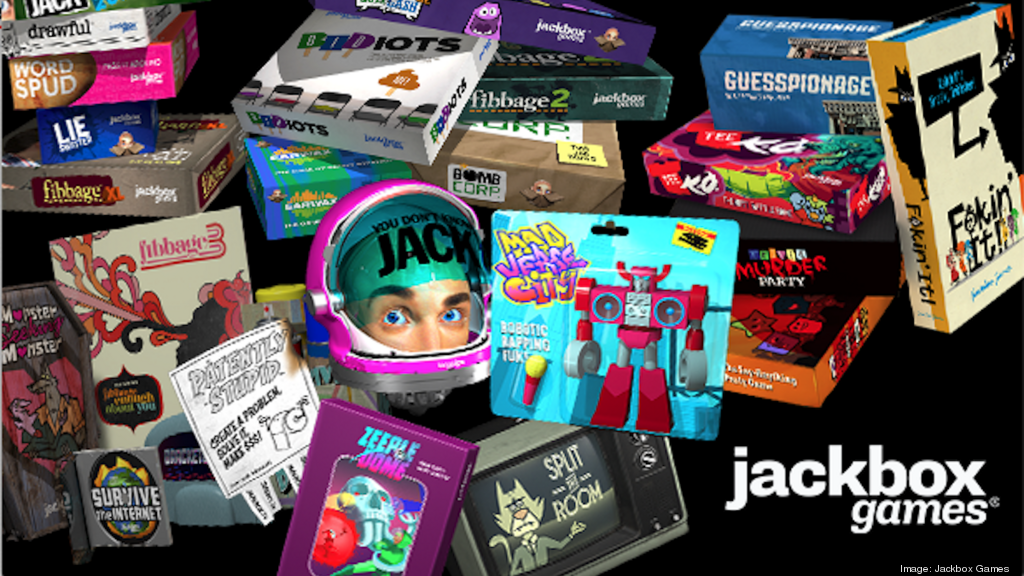
You are a GUI agent. You are given a task and a screenshot of the screen. Output one action in this format:
    pyautogui.click(x=<x>, y=<y>)
    Task: Click on the television screen
    The width and height of the screenshot is (1024, 576).
    Given the screenshot: What is the action you would take?
    pyautogui.click(x=542, y=482)